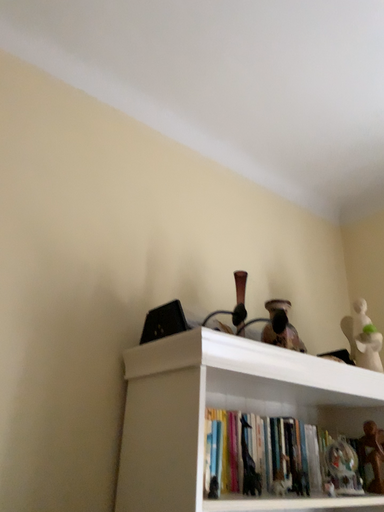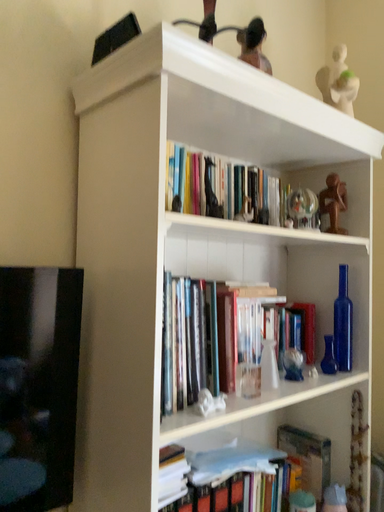
Question: Which way did the camera rotate in the video?

Choices:
 (A) rotated upward
 (B) rotated downward

Answer: (B)